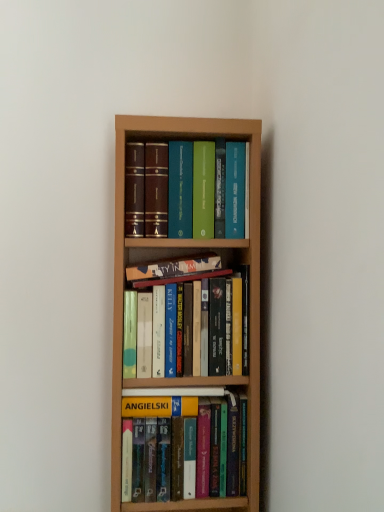
Where is `vacant point above hardcover book at center, which ranks as the 4th book in top-to-bottom order (from a real-world perspective)`? The image size is (384, 512). vacant point above hardcover book at center, which ranks as the 4th book in top-to-bottom order (from a real-world perspective) is located at coordinates (188, 403).